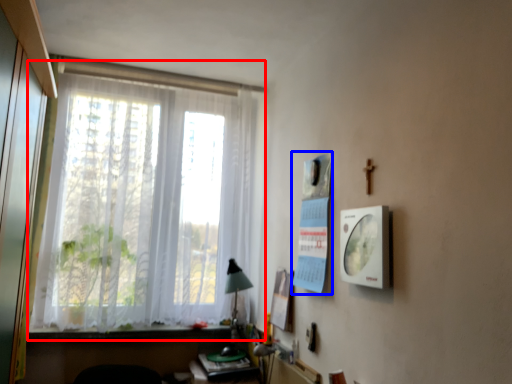
Question: Which object appears closest to the camera in this image, window (highlighted by a red box) or poster page (highlighted by a blue box)?

Choices:
 (A) window
 (B) poster page

Answer: (B)